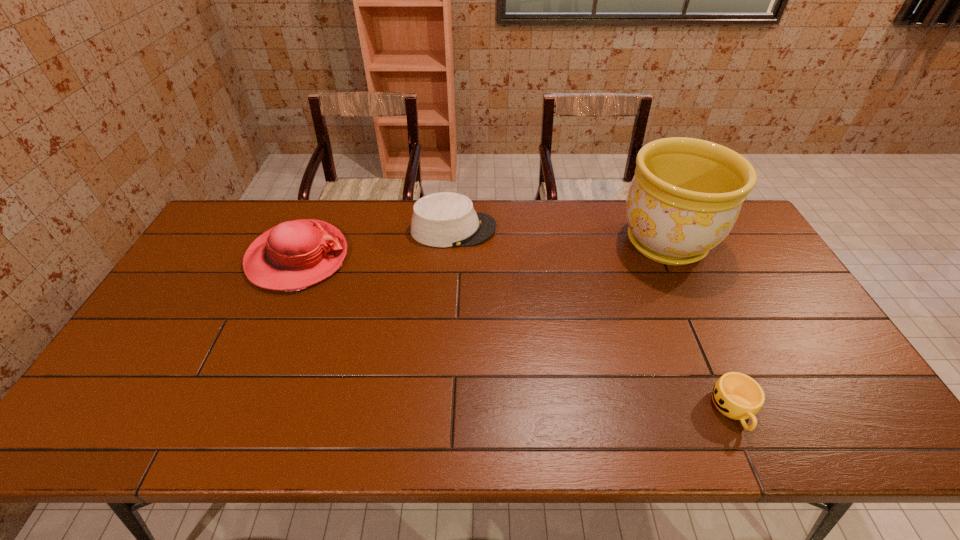
Identify the location of empty space that is in between the flowerpot and the second tallest object. The height and width of the screenshot is (540, 960). 482,250.

Find the location of a particular element. vacant area that lies between the second tallest object and the cup is located at coordinates (516, 334).

Where is `free space between the right hat and the tallest object`? free space between the right hat and the tallest object is located at coordinates (560, 236).

At what (x,y) coordinates should I click in order to perform the action: click on empty space that is in between the shortest object and the second tallest object. Please return your answer as a coordinate pair (x, y). Looking at the image, I should click on (516, 334).

Find the location of a particular element. This screenshot has height=540, width=960. vacant area that lies between the flowerpot and the second object from left to right is located at coordinates (560, 236).

Find the location of a particular element. The width and height of the screenshot is (960, 540). free space between the third object from right to left and the leftmost object is located at coordinates (375, 244).

You are a GUI agent. You are given a task and a screenshot of the screen. Output one action in this format:
    pyautogui.click(x=<x>, y=<y>)
    Task: Click on the vacant area between the shorter hat and the cup
    Image resolution: width=960 pixels, height=540 pixels.
    Given the screenshot: What is the action you would take?
    pyautogui.click(x=594, y=320)

This screenshot has height=540, width=960. Identify the location of vacant space in between the shortest object and the flowerpot. (700, 326).

Locate an element on the screen. free space between the left hat and the flowerpot is located at coordinates (482, 250).

The width and height of the screenshot is (960, 540). Find the location of `the second closest object to the leftmost object`. the second closest object to the leftmost object is located at coordinates (686, 195).